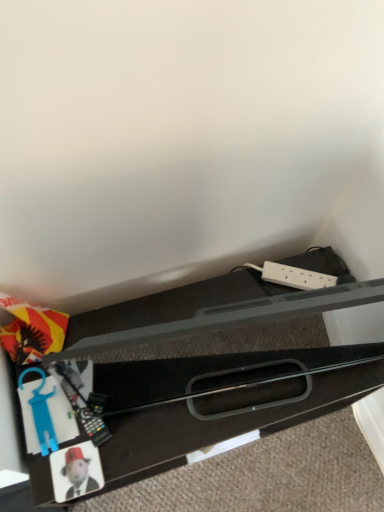
Question: In terms of size, does blue plastic toy at lower left, marked as the first toy in a top-to-bottom arrangement, appear bigger or smaller than matte plastic coaster at lower left, the 1th toy positioned from the bottom?

Choices:
 (A) big
 (B) small

Answer: (A)

Question: Looking at their shapes, would you say blue plastic toy at lower left, which appears as the second toy when ordered from the bottom, is wider or thinner than matte plastic coaster at lower left, the 1th toy positioned from the bottom?

Choices:
 (A) thin
 (B) wide

Answer: (B)

Question: Estimate the real-world distances between objects in this image. Which object is closer to the blue plastic toy at lower left, marked as the first toy in a top-to-bottom arrangement?

Choices:
 (A) matte plastic coaster at lower left, the 1th toy positioned from the bottom
 (B) black plastic drawer at lower left

Answer: (A)

Question: Based on their relative distances, which object is nearer to the blue plastic toy at lower left, marked as the first toy in a top-to-bottom arrangement?

Choices:
 (A) black plastic drawer at lower left
 (B) matte plastic coaster at lower left, the 1th toy positioned from the bottom

Answer: (B)